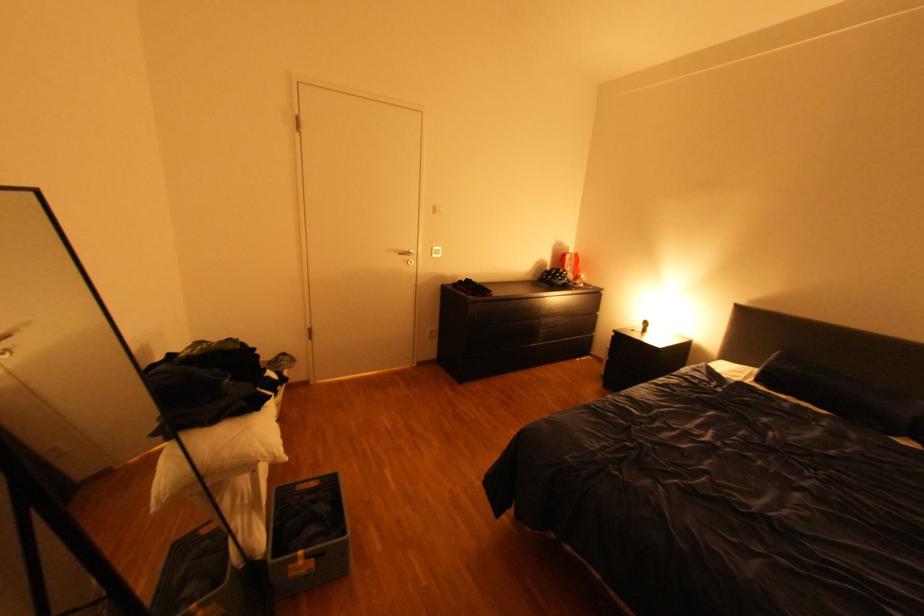
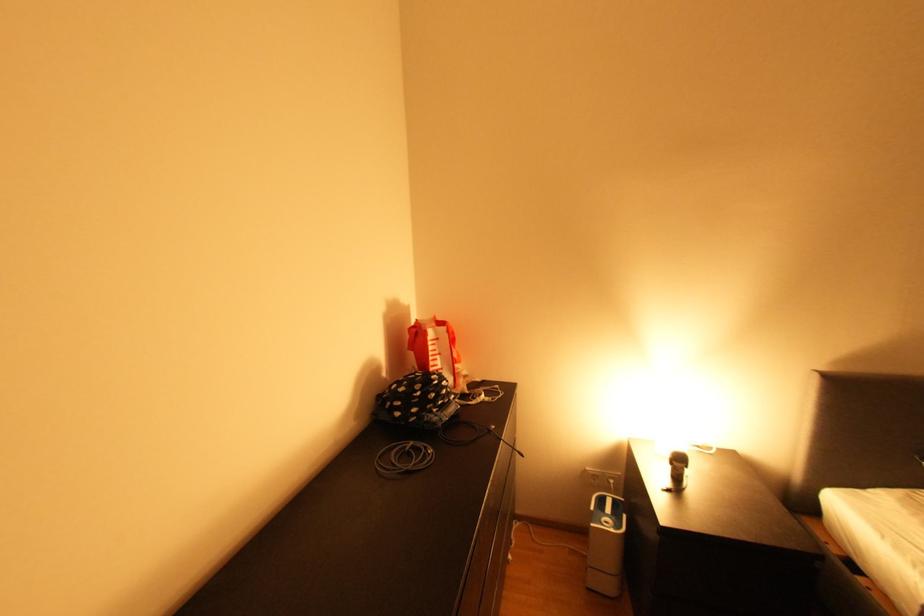
In the second image, find the point that corresponds to (x=576, y=276) in the first image.

(457, 389)